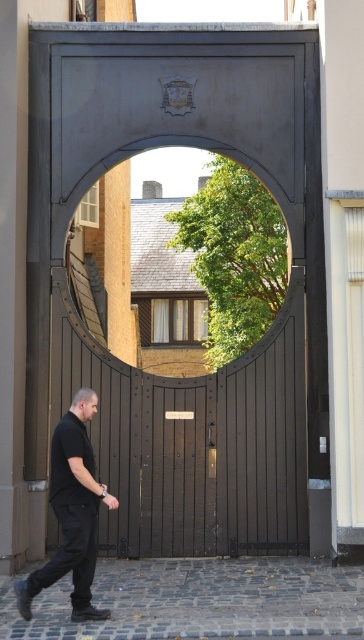
Who is positioned more to the left, dark brown wooden gate at center or black matte pants at lower left?

From the viewer's perspective, black matte pants at lower left appears more on the left side.

At what (x,y) coordinates should I click in order to perform the action: click on dark brown wooden gate at center. Please return your answer as a coordinate pair (x, y). The height and width of the screenshot is (640, 364). Looking at the image, I should click on (232, 157).

Identify the location of dark brown wooden gate at center. Image resolution: width=364 pixels, height=640 pixels. (232, 157).

Who is more forward, (216, 588) or (64, 528)?

Point (64, 528) is in front.

Is point (315, 616) behind point (78, 481)?

Yes, it is.

Which is behind, point (252, 616) or point (72, 520)?

Point (252, 616)

Find the location of a particular element. This screenshot has height=640, width=364. brown cobblestone alley at lower center is located at coordinates (199, 600).

Does dark brown wooden gate at center appear under brown cobblestone alley at lower center?

Actually, dark brown wooden gate at center is above brown cobblestone alley at lower center.

Which is more to the right, dark brown wooden gate at center or brown cobblestone alley at lower center?

From the viewer's perspective, brown cobblestone alley at lower center appears more on the right side.

Which is in front, point (235, 394) or point (338, 593)?

Point (338, 593) is more forward.

At what (x,y) coordinates should I click in order to perform the action: click on dark brown wooden gate at center. Please return your answer as a coordinate pair (x, y). Image resolution: width=364 pixels, height=640 pixels. Looking at the image, I should click on (232, 157).